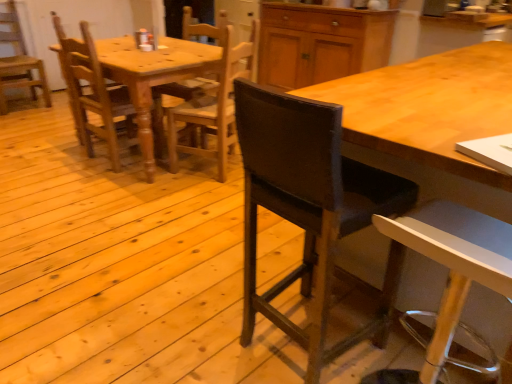
You are a GUI agent. You are given a task and a screenshot of the screen. Output one action in this format:
    pyautogui.click(x=<x>, y=<y>)
    Task: Click on the wooden chair at left, placed as the 5th chair when sorted from right to left
    This screenshot has width=512, height=384.
    Given the screenshot: What is the action you would take?
    pyautogui.click(x=19, y=61)

Where is `matte wood cabinet at upper center`? The image size is (512, 384). matte wood cabinet at upper center is located at coordinates (320, 43).

What do you see at coordinates (320, 43) in the screenshot? I see `matte wood cabinet at upper center` at bounding box center [320, 43].

What do you see at coordinates (307, 207) in the screenshot?
I see `dark brown leather chair at center, which is the 2th chair from front to back` at bounding box center [307, 207].

Locate an element on the screen. dark brown leather chair at center, which is counted as the fourth chair, starting from the left is located at coordinates (307, 207).

At what (x,y) coordinates should I click in order to perform the action: click on wooden chair at left, placed as the 1th chair when sorted from left to right. Please return your answer as a coordinate pair (x, y). Looking at the image, I should click on (19, 61).

Is matte wood cabinet at upper center to the left of wooden chair at center, positioned as the fourth chair in right-to-left order, from the viewer's perspective?

In fact, matte wood cabinet at upper center is to the right of wooden chair at center, positioned as the fourth chair in right-to-left order.

Is matte wood cabinet at upper center facing away from wooden chair at center, marked as the second chair in a left-to-right arrangement?

matte wood cabinet at upper center does not have its back to wooden chair at center, marked as the second chair in a left-to-right arrangement.

Looking at the image, does matte wood cabinet at upper center seem bigger or smaller compared to wooden chair at center, marked as the second chair in a left-to-right arrangement?

matte wood cabinet at upper center is bigger than wooden chair at center, marked as the second chair in a left-to-right arrangement.

In terms of width, does matte wood cabinet at upper center look wider or thinner when compared to wooden chair at center, marked as the second chair in a left-to-right arrangement?

Considering their sizes, matte wood cabinet at upper center looks broader than wooden chair at center, marked as the second chair in a left-to-right arrangement.

Which point is more forward, (322, 322) or (298, 62)?

The point (322, 322) is closer.

From the image's perspective, relative to matte wood cabinet at upper center, is dark brown leather chair at center, positioned as the second chair in right-to-left order, above or below?

From the image's perspective, dark brown leather chair at center, positioned as the second chair in right-to-left order, appears below matte wood cabinet at upper center.

Is dark brown leather chair at center, positioned as the second chair in right-to-left order, inside or outside of matte wood cabinet at upper center?

dark brown leather chair at center, positioned as the second chair in right-to-left order, is not enclosed by matte wood cabinet at upper center.

Is dark brown leather chair at center, acting as the fourth chair starting from the back, turned away from matte wood cabinet at upper center?

No, dark brown leather chair at center, acting as the fourth chair starting from the back,'s orientation is not away from matte wood cabinet at upper center.

Is wooden chair at center, which appears as the second chair when viewed from the back, not close to wooden desk at center?

Yes, wooden chair at center, which appears as the second chair when viewed from the back, and wooden desk at center are quite far apart.

In the scene shown: From the image's perspective, who appears lower, wooden chair at center, marked as the second chair in a left-to-right arrangement, or wooden desk at center?

wooden desk at center is shown below in the image.

Can you confirm if wooden chair at center, positioned as the fourth chair in right-to-left order, is smaller than wooden desk at center?

Yes, wooden chair at center, positioned as the fourth chair in right-to-left order, is smaller than wooden desk at center.

Locate an element on the screen. The width and height of the screenshot is (512, 384). cabinetry located on the right of wooden chair at left, placed as the 5th chair when sorted from right to left is located at coordinates (320, 43).

Is wooden chair at left, the 1th chair in the back-to-front sequence, behind matte wood cabinet at upper center?

No, it is in front of matte wood cabinet at upper center.

Consider the image. Is matte wood cabinet at upper center at the back of wooden chair at left, the 5th chair viewed from the front?

No, wooden chair at left, the 5th chair viewed from the front,'s orientation is not away from matte wood cabinet at upper center.

Is point (441, 102) positioned behind point (2, 59)?

No.

The image size is (512, 384). I want to click on chair that is the 3rd one when counting upward from the wooden desk at center (from the image's perspective), so click(19, 61).

Is wooden desk at center closer to camera compared to wooden chair at left, placed as the 1th chair when sorted from left to right?

Yes, it is in front of wooden chair at left, placed as the 1th chair when sorted from left to right.

Between wooden desk at center and wooden chair at left, the 1th chair in the back-to-front sequence, which one has smaller size?

Smaller between the two is wooden chair at left, the 1th chair in the back-to-front sequence.

In the scene shown: From the image's perspective, is wooden chair at center, which appears as the second chair when viewed from the back, above or below white plastic stool at lower right, marked as the 5th chair in a back-to-front arrangement?

wooden chair at center, which appears as the second chair when viewed from the back, is situated higher than white plastic stool at lower right, marked as the 5th chair in a back-to-front arrangement, in the image.

Which object is thinner, wooden chair at center, positioned as the fourth chair in right-to-left order, or white plastic stool at lower right, the first chair viewed from the front?

With smaller width is wooden chair at center, positioned as the fourth chair in right-to-left order.

Between wooden chair at center, acting as the 4th chair starting from the front, and white plastic stool at lower right, the first chair viewed from the front, which one has larger size?

With larger size is wooden chair at center, acting as the 4th chair starting from the front.

From a real-world perspective, who is located lower, wooden chair at center, marked as the second chair in a left-to-right arrangement, or white plastic stool at lower right, marked as the 5th chair in a back-to-front arrangement?

In real-world perspective, white plastic stool at lower right, marked as the 5th chair in a back-to-front arrangement, is lower.

Based on the photo, considering the relative sizes of wooden chair at center, the third chair positioned from the front, and dark brown leather chair at center, acting as the fourth chair starting from the back, in the image provided, is wooden chair at center, the third chair positioned from the front, bigger than dark brown leather chair at center, acting as the fourth chair starting from the back,?

Incorrect, wooden chair at center, the third chair positioned from the front, is not larger than dark brown leather chair at center, acting as the fourth chair starting from the back.

Considering their positions, is wooden chair at center, the third chair positioned from the front, located in front of or behind dark brown leather chair at center, acting as the fourth chair starting from the back?

Clearly, wooden chair at center, the third chair positioned from the front, is behind dark brown leather chair at center, acting as the fourth chair starting from the back.

From a real-world perspective, is wooden chair at center, the third chair positioned from the front, physically located above or below dark brown leather chair at center, positioned as the second chair in right-to-left order?

From a real-world perspective, wooden chair at center, the third chair positioned from the front, is physically below dark brown leather chair at center, positioned as the second chair in right-to-left order.

At what (x,y) coordinates should I click in order to perform the action: click on the 3rd chair below the matte wood cabinet at upper center (from a real-world perspective). Please return your answer as a coordinate pair (x, y). The width and height of the screenshot is (512, 384). Looking at the image, I should click on (92, 92).

From the image's perspective, which chair is the 4th one below the matte wood cabinet at upper center? Please provide its 2D coordinates.

[(307, 207)]

Based on their spatial positions, is wooden chair at center, acting as the 4th chair starting from the front, or dark brown leather chair at center, which is the 2th chair from front to back, further from white plastic stool at lower right, arranged as the first chair when viewed from the right?

wooden chair at center, acting as the 4th chair starting from the front, is positioned further to the anchor white plastic stool at lower right, arranged as the first chair when viewed from the right.

Looking at the image, which one is located closer to wooden chair at center, which is the third chair from back to front, matte wood cabinet at upper center or dark brown leather chair at center, which is counted as the fourth chair, starting from the left?

matte wood cabinet at upper center is positioned closer to the anchor wooden chair at center, which is the third chair from back to front.

Which object lies nearer to the anchor point white plastic stool at lower right, marked as the 5th chair in a back-to-front arrangement, matte wood cabinet at upper center or dark brown leather chair at center, acting as the fourth chair starting from the back?

dark brown leather chair at center, acting as the fourth chair starting from the back.

Considering their positions, is matte wood cabinet at upper center positioned closer to wooden chair at left, the 1th chair in the back-to-front sequence, than white plastic stool at lower right, the first chair viewed from the front?

matte wood cabinet at upper center is closer to wooden chair at left, the 1th chair in the back-to-front sequence.

Consider the image. Estimate the real-world distances between objects in this image. Which object is closer to wooden chair at center, which is the third chair from back to front, white plastic stool at lower right, which is counted as the fifth chair, starting from the left, or wooden chair at left, the 1th chair in the back-to-front sequence?

white plastic stool at lower right, which is counted as the fifth chair, starting from the left.

When comparing their distances from wooden chair at center, which appears as the second chair when viewed from the back, does wooden chair at left, placed as the 1th chair when sorted from left to right, or wooden desk at center seem further?

The object further to wooden chair at center, which appears as the second chair when viewed from the back, is wooden desk at center.

Based on their spatial positions, is wooden chair at left, placed as the 1th chair when sorted from left to right, or dark brown leather chair at center, which is counted as the fourth chair, starting from the left, further from wooden desk at center?

wooden chair at left, placed as the 1th chair when sorted from left to right, is further to wooden desk at center.

Looking at the image, which one is located further to wooden chair at left, placed as the 5th chair when sorted from right to left, wooden chair at center, which appears as the second chair when viewed from the back, or wooden desk at center?

wooden desk at center lies further to wooden chair at left, placed as the 5th chair when sorted from right to left, than the other object.

Find the location of a particular element. The height and width of the screenshot is (384, 512). desk between white plastic stool at lower right, marked as the 5th chair in a back-to-front arrangement, and wooden chair at center, the third chair positioned from the front, from front to back is located at coordinates (430, 117).

At what (x,y) coordinates should I click in order to perform the action: click on chair between white plastic stool at lower right, the first chair viewed from the front, and wooden chair at center, which is the third chair from back to front, along the z-axis. Please return your answer as a coordinate pair (x, y). This screenshot has height=384, width=512. Looking at the image, I should click on (307, 207).

Identify the location of chair between dark brown leather chair at center, which is the 2th chair from front to back, and wooden chair at center, positioned as the fourth chair in right-to-left order, in the front-back direction. (214, 106).

Locate an element on the screen. The height and width of the screenshot is (384, 512). desk between white plastic stool at lower right, the first chair viewed from the front, and matte wood cabinet at upper center, along the z-axis is located at coordinates (430, 117).